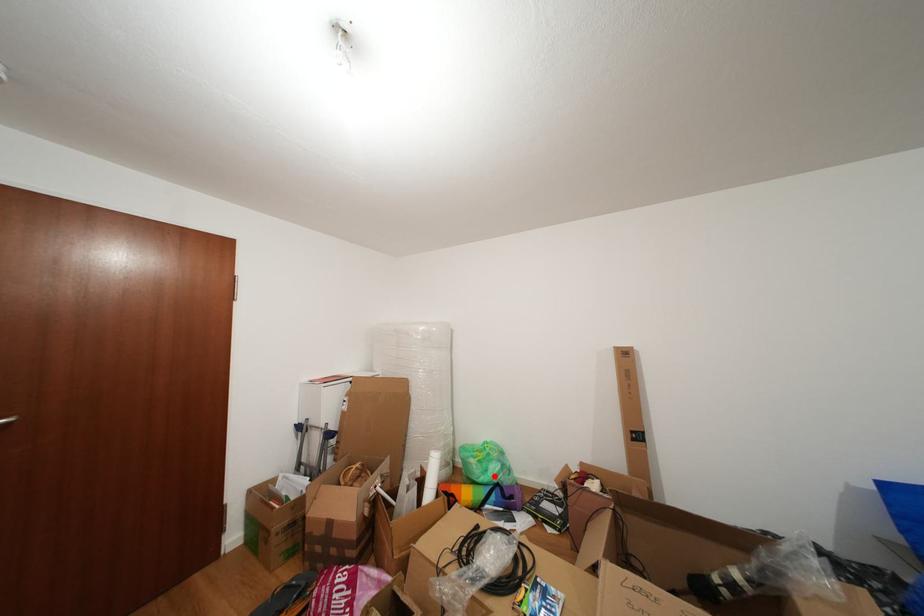
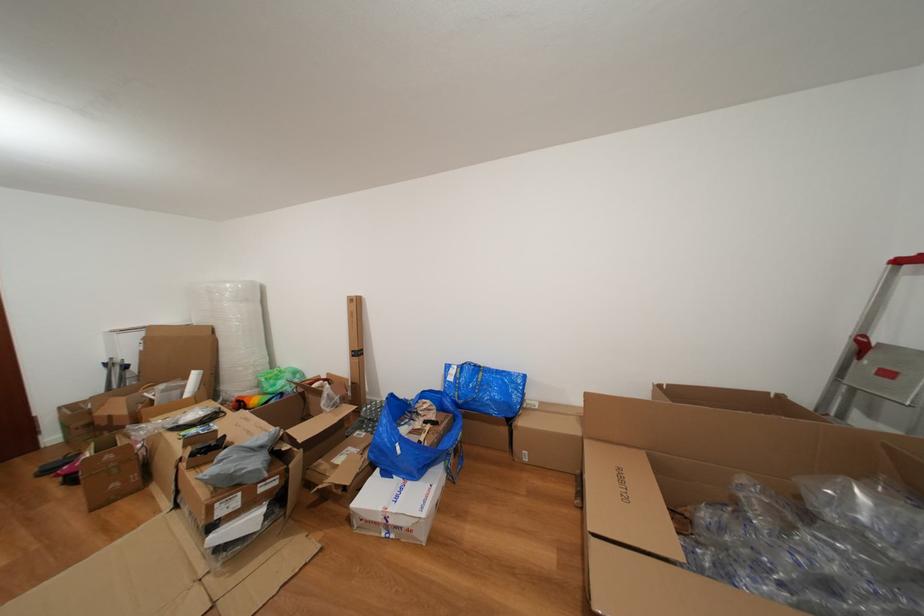
Where in the second image is the point corresponding to the highlighted location from the first image?

(283, 390)